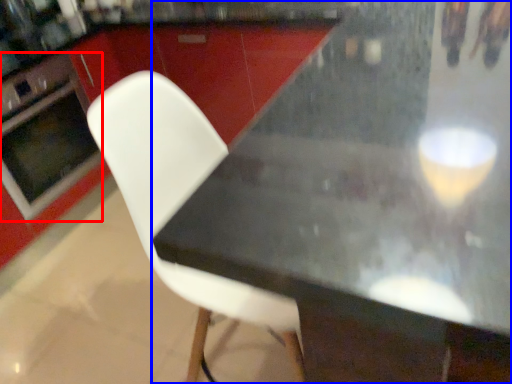
Question: Which of the following is the farthest to the observer, oven (highlighted by a red box) or table (highlighted by a blue box)?

Choices:
 (A) oven
 (B) table

Answer: (A)